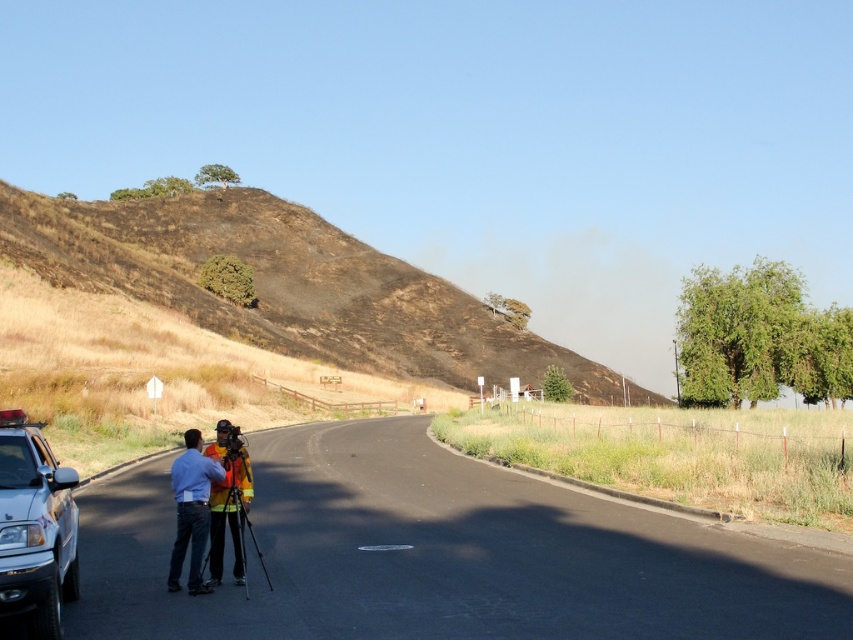
You are a pedestrian standing on the black asphalt road at center and want to reach the burnt grass at upper left. Which direction should you walk to get there?

The burnt grass at upper left is to the left of the black asphalt road at center, so you should walk to the left to reach it.

You are a delivery driver who needs to avoid the burnt grass at upper left and the silver metallic truck at lower left while driving on the road. Which object should you steer away from first as you move forward?

The burnt grass at upper left is to the left of the silver metallic truck at lower left, so you should steer away from the burnt grass at upper left first as it is positioned further to the left compared to the silver metallic truck at lower left.

You are standing at the position of the two individuals near the white vehicle on the left side of the road. You want to walk to the point marked at coordinates (285, 326). How far will you have to walk?

The point marked at coordinates (285, 326) is 106.95 meters away from your current position, so you will have to walk 106.95 meters.